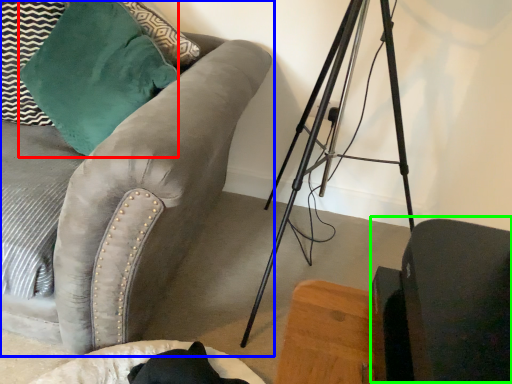
Question: Considering the real-world distances, which object is closest to throw pillow (highlighted by a red box)? studio couch (highlighted by a blue box) or swivel chair (highlighted by a green box).

Choices:
 (A) studio couch
 (B) swivel chair

Answer: (A)